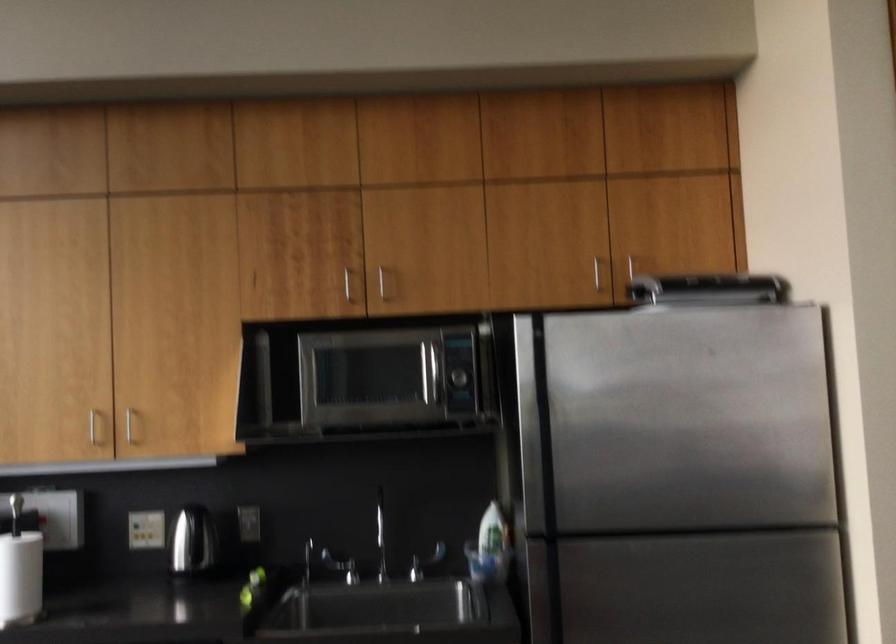
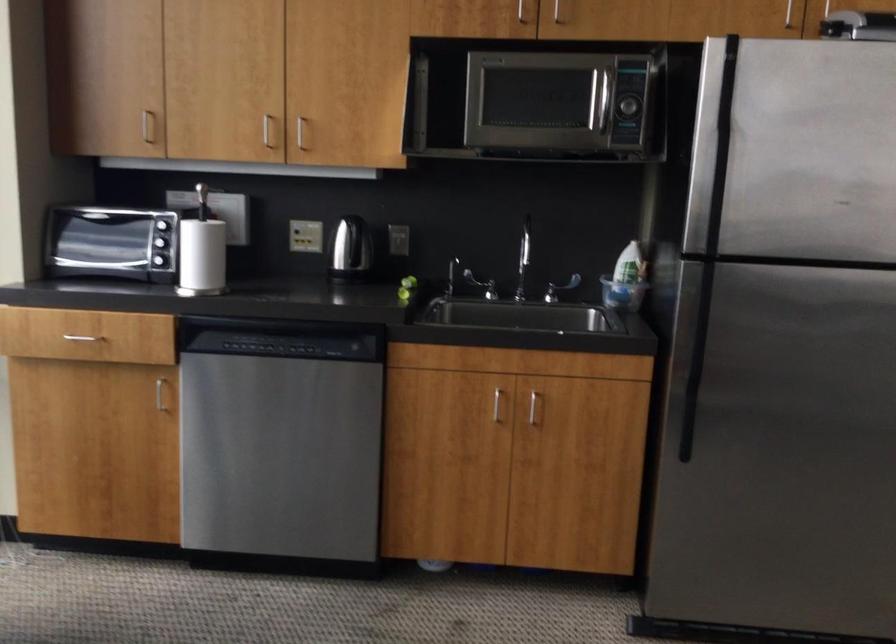
The point at (260,569) is marked in the first image. Where is the corresponding point in the second image?

(409, 281)